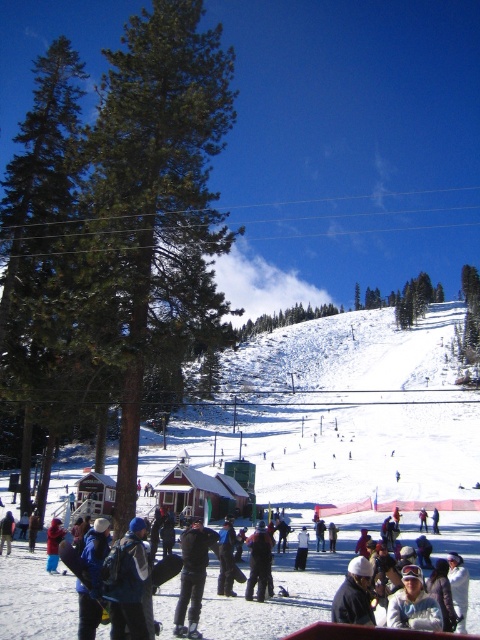
Which is behind, point (62, 531) or point (300, 564)?

The point (300, 564) is more distant.

I want to click on blue woolen hat at lower left, so click(x=54, y=544).

Is white matte jacket at center above blue woolen hat at lower left?

Indeed, white matte jacket at center is positioned over blue woolen hat at lower left.

Between point (415, 570) and point (56, 564), which one is positioned behind?

The point (56, 564) is behind.

I want to click on white matte jacket at center, so click(414, 604).

Can you confirm if white powdery snow at center is positioned above white snowboarder at center?

Yes, white powdery snow at center is above white snowboarder at center.

Measure the distance from white powdery snow at center to white snowboarder at center.

white powdery snow at center is 91.00 meters from white snowboarder at center.

Describe the element at coordinates (344, 444) in the screenshot. I see `white powdery snow at center` at that location.

This screenshot has width=480, height=640. I want to click on white powdery snow at center, so click(x=344, y=444).